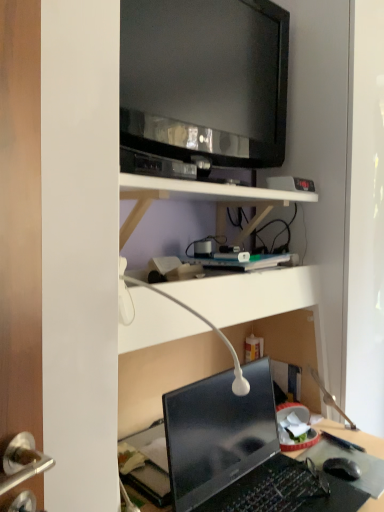
Question: Can you confirm if black glossy television at upper center is positioned to the right of white matte shelf at upper center?

Choices:
 (A) yes
 (B) no

Answer: (A)

Question: Does black glossy television at upper center have a larger size compared to white matte shelf at upper center?

Choices:
 (A) no
 (B) yes

Answer: (A)

Question: Is black glossy television at upper center far away from white matte shelf at upper center?

Choices:
 (A) yes
 (B) no

Answer: (B)

Question: Is white matte shelf at upper center completely or partially inside black glossy television at upper center?

Choices:
 (A) yes
 (B) no

Answer: (B)

Question: From a real-world perspective, is black glossy television at upper center on white matte shelf at upper center?

Choices:
 (A) yes
 (B) no

Answer: (A)

Question: Is black glossy television at upper center smaller than white matte shelf at upper center?

Choices:
 (A) yes
 (B) no

Answer: (A)

Question: Are white matte shelf at upper center and black matte computer mouse at lower right located far from each other?

Choices:
 (A) yes
 (B) no

Answer: (B)

Question: From a real-world perspective, is white matte shelf at upper center located higher than black matte computer mouse at lower right?

Choices:
 (A) no
 (B) yes

Answer: (B)

Question: Is white matte shelf at upper center to the left of black matte computer mouse at lower right from the viewer's perspective?

Choices:
 (A) no
 (B) yes

Answer: (B)

Question: Is white matte shelf at upper center to the right of black matte computer mouse at lower right from the viewer's perspective?

Choices:
 (A) yes
 (B) no

Answer: (B)

Question: Considering the relative sizes of white matte shelf at upper center and black matte computer mouse at lower right in the image provided, is white matte shelf at upper center shorter than black matte computer mouse at lower right?

Choices:
 (A) yes
 (B) no

Answer: (B)

Question: Would you say white matte shelf at upper center contains black matte computer mouse at lower right?

Choices:
 (A) no
 (B) yes

Answer: (A)

Question: Is white glossy table lamp at center looking in the opposite direction of glossy black laptop at lower center?

Choices:
 (A) no
 (B) yes

Answer: (A)